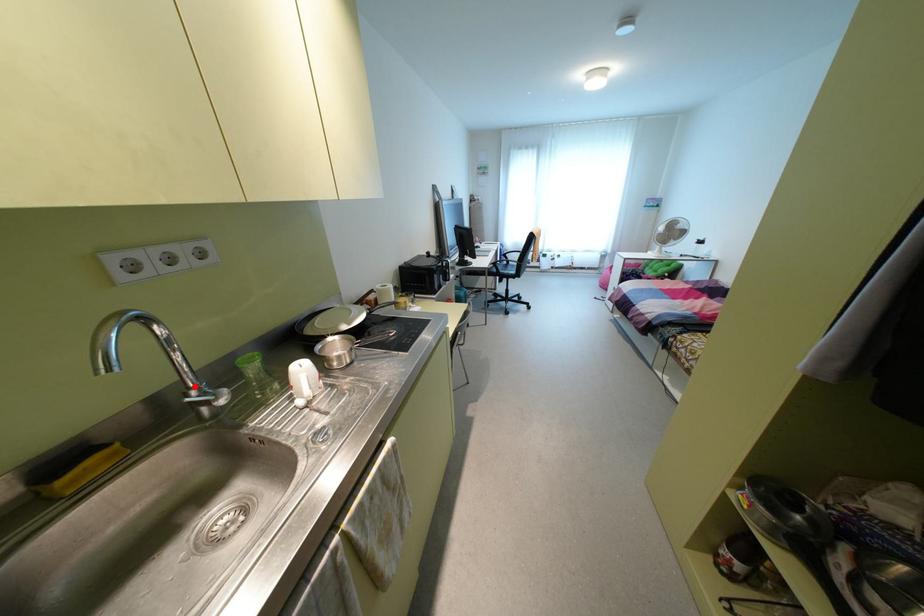
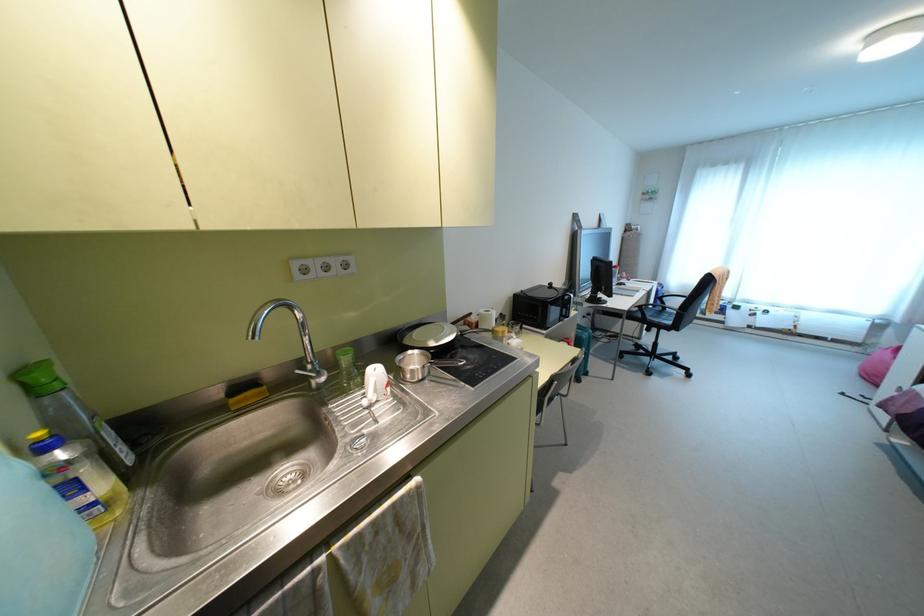
Question: I am providing you with two images of the same scene from different viewpoints. A red point is marked on the first image. At the location where the point appears in image 1, is it still visible in image 2?

Choices:
 (A) Yes
 (B) No

Answer: (A)